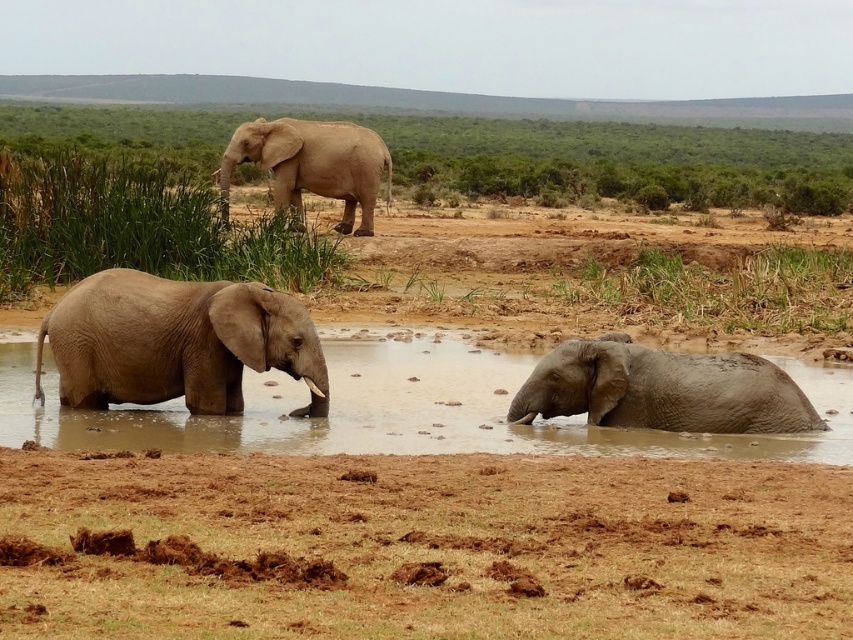
Question: Is brown dry soil at lower center behind grayish-brown wrinkled skin elephant at lower left?

Choices:
 (A) yes
 (B) no

Answer: (B)

Question: Which object appears closest to the camera in this image?

Choices:
 (A) brown dry soil at lower center
 (B) brown muddy water at center
 (C) gray matte elephant at lower right

Answer: (A)

Question: Is brown dry soil at lower center wider than brown muddy water at center?

Choices:
 (A) no
 (B) yes

Answer: (A)

Question: Among these objects, which one is nearest to the camera?

Choices:
 (A) brown dry soil at lower center
 (B) gray matte elephant at upper center
 (C) grayish-brown wrinkled skin elephant at lower left

Answer: (A)

Question: Which point is farther to the camera?

Choices:
 (A) grayish-brown wrinkled skin elephant at lower left
 (B) gray matte elephant at lower right

Answer: (B)

Question: Does brown muddy water at center appear over grayish-brown wrinkled skin elephant at lower left?

Choices:
 (A) no
 (B) yes

Answer: (A)